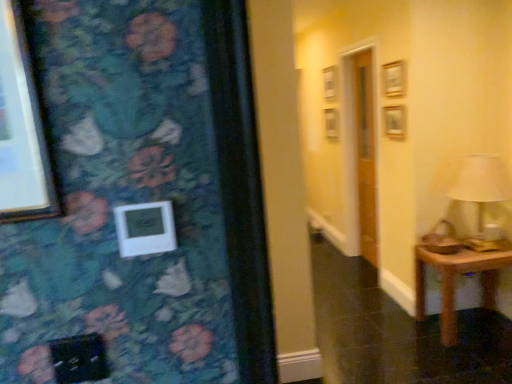
Question: Are white plastic picture frame at center and brown wooden table at lower right far apart?

Choices:
 (A) yes
 (B) no

Answer: (A)

Question: From the image's perspective, is white plastic picture frame at center located beneath brown wooden table at lower right?

Choices:
 (A) yes
 (B) no

Answer: (B)

Question: Is white plastic picture frame at center turned away from brown wooden table at lower right?

Choices:
 (A) yes
 (B) no

Answer: (B)

Question: Is white plastic picture frame at center at the right side of brown wooden table at lower right?

Choices:
 (A) yes
 (B) no

Answer: (B)

Question: Is white plastic picture frame at center smaller than brown wooden table at lower right?

Choices:
 (A) no
 (B) yes

Answer: (B)

Question: Looking at their shapes, would you say brown wooden table at lower right is wider or thinner than white plastic picture frame at center?

Choices:
 (A) wide
 (B) thin

Answer: (A)

Question: Considering the positions of point (420, 258) and point (141, 225), is point (420, 258) closer or farther from the camera than point (141, 225)?

Choices:
 (A) farther
 (B) closer

Answer: (A)

Question: Relative to white plastic picture frame at center, is brown wooden table at lower right in front or behind?

Choices:
 (A) behind
 (B) front

Answer: (A)

Question: From the image's perspective, relative to white plastic picture frame at center, is brown wooden table at lower right above or below?

Choices:
 (A) below
 (B) above

Answer: (A)

Question: In terms of width, does brown wooden table at lower right look wider or thinner when compared to white fabric lampshade at right?

Choices:
 (A) thin
 (B) wide

Answer: (B)

Question: Would you say brown wooden table at lower right is inside or outside white fabric lampshade at right?

Choices:
 (A) outside
 (B) inside

Answer: (A)

Question: In the image, is brown wooden table at lower right positioned in front of or behind white fabric lampshade at right?

Choices:
 (A) behind
 (B) front

Answer: (A)

Question: Based on their sizes in the image, would you say brown wooden table at lower right is bigger or smaller than white fabric lampshade at right?

Choices:
 (A) big
 (B) small

Answer: (A)

Question: From a real-world perspective, relative to brown wooden table at lower right, is white plastic picture frame at center vertically above or below?

Choices:
 (A) above
 (B) below

Answer: (A)

Question: Is white plastic picture frame at center bigger or smaller than brown wooden table at lower right?

Choices:
 (A) big
 (B) small

Answer: (B)